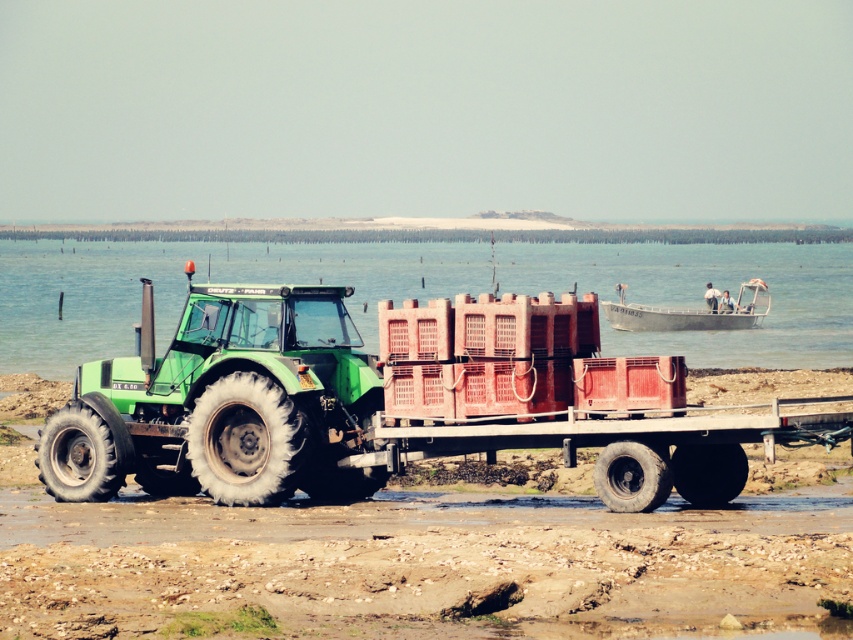
This screenshot has width=853, height=640. Find the location of `green matte trailer truck at center`. green matte trailer truck at center is located at coordinates (x=392, y=401).

Is green matte trailer truck at center taller than green matte tractor at center?

No.

Does point (383, 461) come farther from viewer compared to point (695, 358)?

That is False.

The image size is (853, 640). In order to click on green matte trailer truck at center in this screenshot , I will do `click(392, 401)`.

Is point (712, 625) positioned before point (602, 308)?

Yes, point (712, 625) is in front of point (602, 308).

Does point (515, 573) come farther from viewer compared to point (662, 320)?

That is False.

What do you see at coordinates (433, 556) in the screenshot? I see `green rubber tractor at center` at bounding box center [433, 556].

The width and height of the screenshot is (853, 640). Find the location of `green rubber tractor at center`. green rubber tractor at center is located at coordinates (433, 556).

Between green rubber tractor at center and green matte tractor at center, which one appears on the left side from the viewer's perspective?

From the viewer's perspective, green matte tractor at center appears more on the left side.

Between green rubber tractor at center and green matte tractor at center, which one has more height?

green matte tractor at center

Find the location of `green rubber tractor at center`. green rubber tractor at center is located at coordinates (433, 556).

You are a GUI agent. You are given a task and a screenshot of the screen. Output one action in this format:
    pyautogui.click(x=<x>, y=<y>)
    Task: Click on the green rubber tractor at center
    
    Given the screenshot: What is the action you would take?
    pyautogui.click(x=433, y=556)